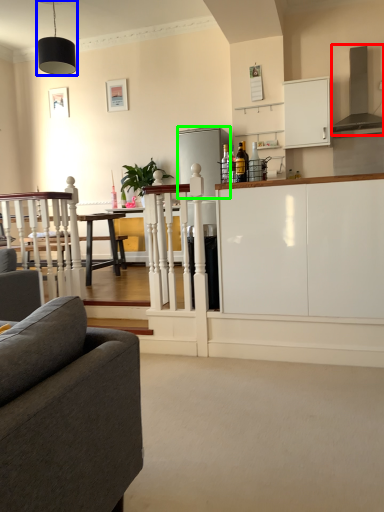
Question: Based on their relative distances, which object is nearer to exhaust hood (highlighted by a red box)? Choose from light fixture (highlighted by a blue box) and appliance (highlighted by a green box).

Choices:
 (A) light fixture
 (B) appliance

Answer: (B)